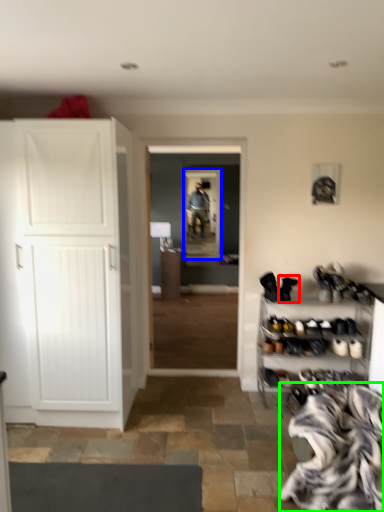
Question: Based on their relative distances, which object is nearer to footwear (highlighted by a red box)? Choose from screen door (highlighted by a blue box) and blanket (highlighted by a green box).

Choices:
 (A) screen door
 (B) blanket

Answer: (B)